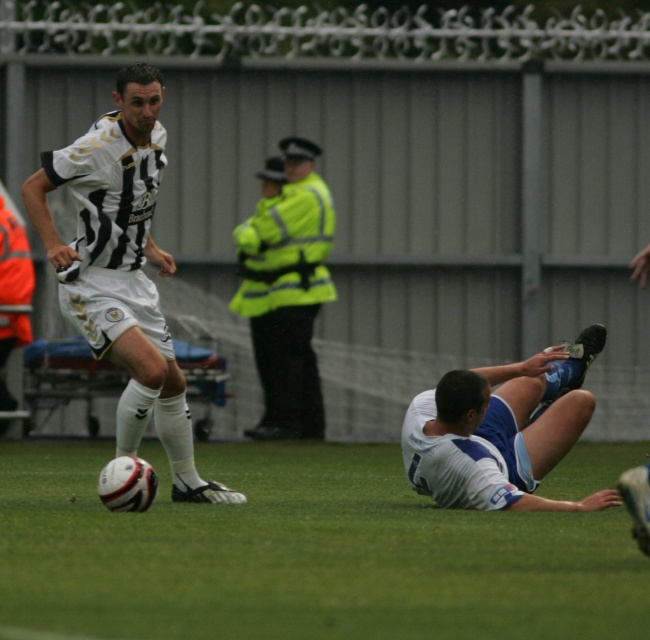
In the soccer match scene, there is a point marked at coordinates (500,432). What object is located at this point?

The point at coordinates 0.672, 0.772 indicates the white matte jersey at lower right.

You are a soccer coach analyzing the game from the sidelines. You notice two key points on the field marked as point (469, 458) and point (255, 339). Which point is closer to your vantage point as the coach?

Point (469, 458) is closer to the camera than point (255, 339), so the point (469, 458) is closer to your vantage point as the coach.